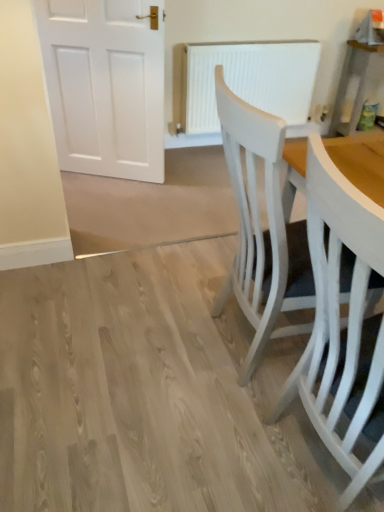
Question: Is white painted wood chair at right, which appears as the 1th chair when viewed from the back, located outside white painted wood chair at right, acting as the 2th chair starting from the back?

Choices:
 (A) no
 (B) yes

Answer: (B)

Question: Is white painted wood chair at right, which appears as the 1th chair when viewed from the back, not near white painted wood chair at right, acting as the 2th chair starting from the back?

Choices:
 (A) yes
 (B) no

Answer: (B)

Question: From the image's perspective, is white painted wood chair at right, which ranks as the second chair in front-to-back order, on top of white painted wood chair at right, which is the first chair in front-to-back order?

Choices:
 (A) no
 (B) yes

Answer: (B)

Question: Does white painted wood chair at right, which ranks as the second chair in front-to-back order, appear on the right side of white painted wood chair at right, which is the first chair in front-to-back order?

Choices:
 (A) yes
 (B) no

Answer: (B)

Question: Considering the relative sizes of white painted wood chair at right, which ranks as the second chair in front-to-back order, and white painted wood chair at right, which is the first chair in front-to-back order, in the image provided, is white painted wood chair at right, which ranks as the second chair in front-to-back order, thinner than white painted wood chair at right, which is the first chair in front-to-back order,?

Choices:
 (A) yes
 (B) no

Answer: (B)

Question: Can you confirm if white painted wood chair at right, which appears as the 1th chair when viewed from the back, is positioned to the left of white painted wood chair at right, which is the first chair in front-to-back order?

Choices:
 (A) yes
 (B) no

Answer: (A)

Question: Does white painted wood chair at right, acting as the 2th chair starting from the back, appear on the right side of white textured radiator at center?

Choices:
 (A) no
 (B) yes

Answer: (B)

Question: Is white painted wood chair at right, which is the first chair in front-to-back order, not within white textured radiator at center?

Choices:
 (A) yes
 (B) no

Answer: (A)

Question: Could you tell me if white painted wood chair at right, which is the first chair in front-to-back order, is turned towards white textured radiator at center?

Choices:
 (A) no
 (B) yes

Answer: (A)

Question: Is white painted wood chair at right, which is the first chair in front-to-back order, positioned with its back to white textured radiator at center?

Choices:
 (A) yes
 (B) no

Answer: (B)

Question: Is white painted wood chair at right, which is the first chair in front-to-back order, touching white textured radiator at center?

Choices:
 (A) yes
 (B) no

Answer: (B)

Question: Does white painted wood chair at right, acting as the 2th chair starting from the back, have a lesser height compared to white textured radiator at center?

Choices:
 (A) yes
 (B) no

Answer: (B)

Question: Is white textured radiator at center turned away from white painted wood chair at right, acting as the 2th chair starting from the back?

Choices:
 (A) yes
 (B) no

Answer: (B)